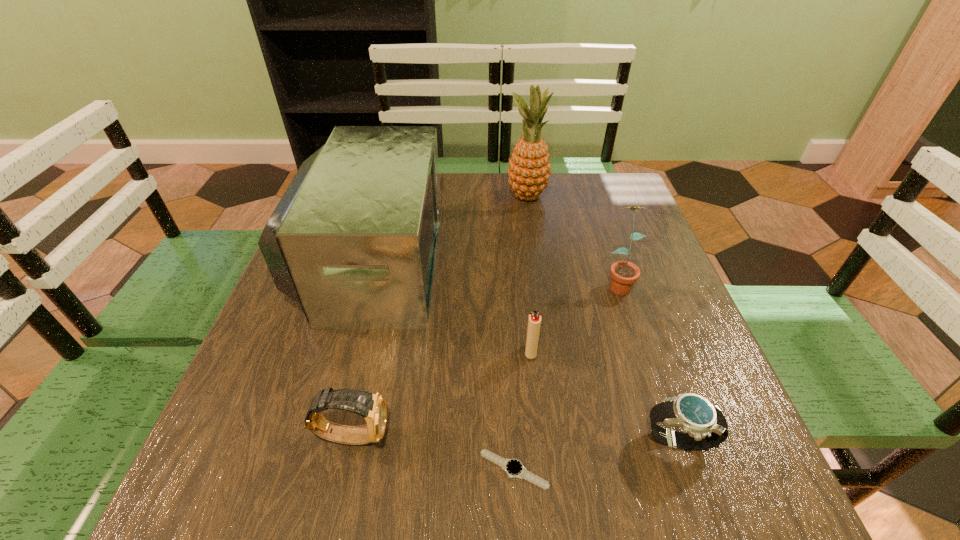
I want to click on vacant space that is in between the fifth shortest object and the sixth shortest object, so click(494, 272).

Locate an element on the screen. The width and height of the screenshot is (960, 540). free space between the shortest object and the rightmost watch is located at coordinates (596, 456).

You are a GUI agent. You are given a task and a screenshot of the screen. Output one action in this format:
    pyautogui.click(x=<x>, y=<y>)
    Task: Click on the vacant space in between the second shortest object and the tallest watch
    
    Given the screenshot: What is the action you would take?
    pyautogui.click(x=516, y=438)

Where is `vacant area that lies between the rightmost watch and the tallest object`? vacant area that lies between the rightmost watch and the tallest object is located at coordinates (603, 319).

This screenshot has height=540, width=960. I want to click on free space between the fifth shortest object and the rightmost watch, so click(648, 362).

Image resolution: width=960 pixels, height=540 pixels. Identify the location of vacant space that is in between the third tallest object and the leftmost watch. (485, 359).

Identify the location of empty location between the pineapple and the microwave oven. The image size is (960, 540). click(449, 228).

Image resolution: width=960 pixels, height=540 pixels. I want to click on free space between the pineapple and the rightmost watch, so click(603, 319).

Identify the location of free space between the second shortest watch and the sunflower. (648, 362).

Find the location of a particular element. object that stands as the closest to the second tallest object is located at coordinates (529, 169).